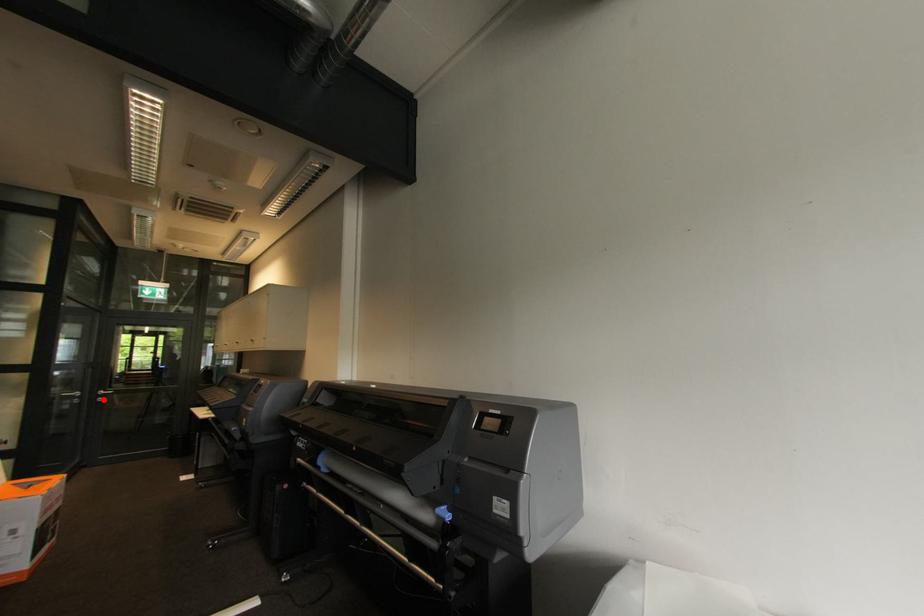
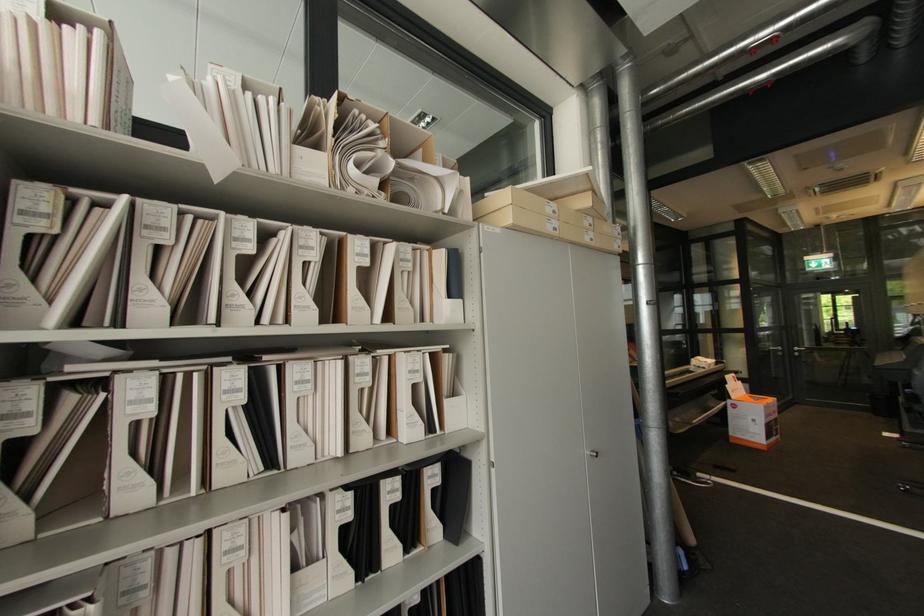
Question: I am providing you with two images of the same scene from different viewpoints. A red point is marked on the first image. Is the red point's position out of view in image 2?

Choices:
 (A) Yes
 (B) No

Answer: (B)